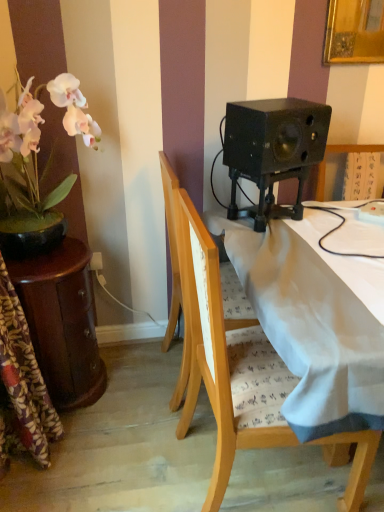
What do you see at coordinates (171, 246) in the screenshot?
I see `wooden chair at center, which ranks as the first chair in back-to-front order` at bounding box center [171, 246].

You are a GUI agent. You are given a task and a screenshot of the screen. Output one action in this format:
    pyautogui.click(x=<x>, y=<y>)
    Task: Click on the pink matte flower pot at left
    
    Given the screenshot: What is the action you would take?
    pyautogui.click(x=37, y=165)

This screenshot has height=512, width=384. What do you see at coordinates (274, 135) in the screenshot?
I see `black matte speaker at upper right` at bounding box center [274, 135].

Where is `wooden chair at center, the 2th chair viewed from the front`? The image size is (384, 512). wooden chair at center, the 2th chair viewed from the front is located at coordinates (171, 246).

Could you tell me if pink matte flower pot at left is facing black matte speaker at upper right?

Yes, pink matte flower pot at left faces towards black matte speaker at upper right.

Looking at the image, does pink matte flower pot at left seem bigger or smaller compared to black matte speaker at upper right?

Clearly, pink matte flower pot at left is larger in size than black matte speaker at upper right.

Does pink matte flower pot at left appear on the left side of black matte speaker at upper right?

Indeed, pink matte flower pot at left is positioned on the left side of black matte speaker at upper right.

From the image's perspective, would you say pink matte flower pot at left is positioned over black matte speaker at upper right?

No, from the image's perspective, pink matte flower pot at left is not above black matte speaker at upper right.

How much distance is there between black matte speaker at upper right and pink matte flower pot at left?

black matte speaker at upper right and pink matte flower pot at left are 27.94 inches apart from each other.

Considering the relative sizes of black matte speaker at upper right and pink matte flower pot at left in the image provided, is black matte speaker at upper right taller than pink matte flower pot at left?

In fact, black matte speaker at upper right may be shorter than pink matte flower pot at left.

Is black matte speaker at upper right in contact with pink matte flower pot at left?

No, black matte speaker at upper right is not beside pink matte flower pot at left.

Is black matte speaker at upper right wider than pink matte flower pot at left?

No, black matte speaker at upper right is not wider than pink matte flower pot at left.

Between mahogany wooden side table at left and pink matte flower pot at left, which one has larger size?

pink matte flower pot at left is bigger.

Is mahogany wooden side table at left not close to pink matte flower pot at left?

No, mahogany wooden side table at left is not far away from pink matte flower pot at left.

This screenshot has width=384, height=512. I want to click on houseplant located above the mahogany wooden side table at left (from the image's perspective), so click(37, 165).

Which is more to the left, mahogany wooden side table at left or pink matte flower pot at left?

From the viewer's perspective, mahogany wooden side table at left appears more on the left side.

Which point is more forward, (323, 111) or (86, 336)?

The point (323, 111) is more forward.

Is black matte speaker at upper right bigger or smaller than mahogany wooden side table at left?

Clearly, black matte speaker at upper right is smaller in size than mahogany wooden side table at left.

From a real-world perspective, is black matte speaker at upper right under mahogany wooden side table at left?

No, from a real-world perspective, black matte speaker at upper right is not below mahogany wooden side table at left.

Is black matte speaker at upper right shorter than mahogany wooden side table at left?

Indeed, black matte speaker at upper right has a lesser height compared to mahogany wooden side table at left.

From a real-world perspective, is wooden chair at center, the 1th chair positioned from the front, over black matte speaker at upper right?

Incorrect, from a real-world perspective, wooden chair at center, the 1th chair positioned from the front, is lower than black matte speaker at upper right.

Considering the sizes of objects wooden chair at center, the 1th chair positioned from the front, and black matte speaker at upper right in the image provided, who is wider, wooden chair at center, the 1th chair positioned from the front, or black matte speaker at upper right?

wooden chair at center, the 1th chair positioned from the front.

How many degrees apart are the facing directions of wooden chair at center, the 2th chair viewed from the back, and black matte speaker at upper right?

65.6 degrees separate the facing orientations of wooden chair at center, the 2th chair viewed from the back, and black matte speaker at upper right.

Who is smaller, wooden chair at center, the 2th chair viewed from the back, or black matte speaker at upper right?

black matte speaker at upper right.

Can you tell me how much mahogany wooden side table at left and black matte speaker at upper right differ in facing direction?

mahogany wooden side table at left and black matte speaker at upper right are facing 62.8 degrees away from each other.

Is mahogany wooden side table at left far away from black matte speaker at upper right?

They are positioned close to each other.

Which is in front, mahogany wooden side table at left or black matte speaker at upper right?

black matte speaker at upper right is more forward.

Is mahogany wooden side table at left at the right side of black matte speaker at upper right?

No.

Is wooden chair at center, the 2th chair viewed from the front, far away from black matte speaker at upper right?

wooden chair at center, the 2th chair viewed from the front, is actually quite close to black matte speaker at upper right.

Looking at this image, does wooden chair at center, which ranks as the first chair in back-to-front order, have a larger size compared to black matte speaker at upper right?

Yes.

Between wooden chair at center, which ranks as the first chair in back-to-front order, and black matte speaker at upper right, which one has less height?

black matte speaker at upper right.

Is point (181, 368) farther from camera compared to point (302, 108)?

Yes, it is.

Where is `speaker above the pink matte flower pot at left (from the image's perspective)`? speaker above the pink matte flower pot at left (from the image's perspective) is located at coordinates click(x=274, y=135).

Identify the location of speaker on the right of the pink matte flower pot at left. The image size is (384, 512). (274, 135).

Considering their positions, is wooden chair at center, which ranks as the first chair in back-to-front order, positioned further to wooden chair at center, the 1th chair positioned from the front, than black matte speaker at upper right?

black matte speaker at upper right is further to wooden chair at center, the 1th chair positioned from the front.

Estimate the real-world distances between objects in this image. Which object is further from wooden chair at center, the 2th chair viewed from the back, mahogany wooden side table at left or pink matte flower pot at left?

The object further to wooden chair at center, the 2th chair viewed from the back, is pink matte flower pot at left.

When comparing their distances from black matte speaker at upper right, does wooden chair at center, the 2th chair viewed from the back, or pink matte flower pot at left seem closer?

wooden chair at center, the 2th chair viewed from the back, lies closer to black matte speaker at upper right than the other object.

From the image, which object appears to be nearer to wooden chair at center, the 2th chair viewed from the back, black matte speaker at upper right or mahogany wooden side table at left?

Among the two, black matte speaker at upper right is located nearer to wooden chair at center, the 2th chair viewed from the back.

Considering their positions, is wooden chair at center, the 2th chair viewed from the back, positioned closer to pink matte flower pot at left than mahogany wooden side table at left?

The object closer to pink matte flower pot at left is mahogany wooden side table at left.

Looking at the image, which one is located further to mahogany wooden side table at left, black matte speaker at upper right or wooden chair at center, the 2th chair viewed from the back?

black matte speaker at upper right is positioned further to the anchor mahogany wooden side table at left.

Considering their positions, is black matte speaker at upper right positioned further to wooden chair at center, the 2th chair viewed from the front, than wooden chair at center, the 1th chair positioned from the front?

black matte speaker at upper right is positioned further to the anchor wooden chair at center, the 2th chair viewed from the front.

Estimate the real-world distances between objects in this image. Which object is closer to mahogany wooden side table at left, wooden chair at center, the 2th chair viewed from the back, or black matte speaker at upper right?

wooden chair at center, the 2th chair viewed from the back, lies closer to mahogany wooden side table at left than the other object.

You are a GUI agent. You are given a task and a screenshot of the screen. Output one action in this format:
    pyautogui.click(x=<x>, y=<y>)
    Task: Click on the houseplant located between mahogany wooden side table at left and wooden chair at center, the 2th chair viewed from the front, in the left-right direction
    This screenshot has width=384, height=512.
    Given the screenshot: What is the action you would take?
    pyautogui.click(x=37, y=165)

Find the location of a particular element. This screenshot has width=384, height=512. chair between black matte speaker at upper right and wooden chair at center, the 2th chair viewed from the back, in the vertical direction is located at coordinates (171, 246).

This screenshot has height=512, width=384. Find the location of `chair between mahogany wooden side table at left and wooden chair at center, the 1th chair positioned from the front`. chair between mahogany wooden side table at left and wooden chair at center, the 1th chair positioned from the front is located at coordinates (171, 246).

Where is `chair between pink matte flower pot at left and wooden chair at center, the 2th chair viewed from the back, in the horizontal direction`? chair between pink matte flower pot at left and wooden chair at center, the 2th chair viewed from the back, in the horizontal direction is located at coordinates (171, 246).